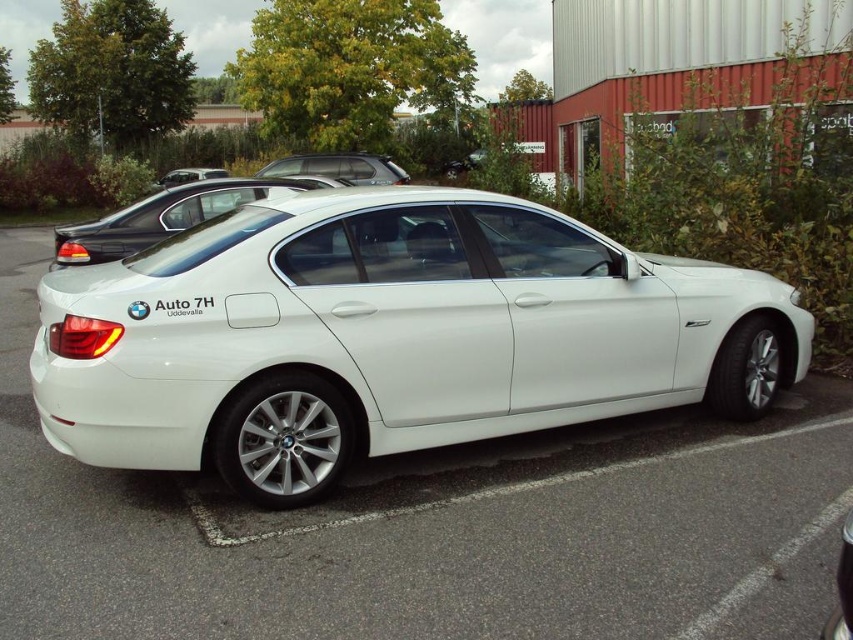
Question: Among these points, which one is farthest from the camera?

Choices:
 (A) (146, 204)
 (B) (71, 269)

Answer: (A)

Question: Estimate the real-world distances between objects in this image. Which object is farther from the matte black car at upper center?

Choices:
 (A) satin silver suv at upper center
 (B) white metallic car at center

Answer: (B)

Question: Is white metallic car at center smaller than satin silver suv at upper center?

Choices:
 (A) yes
 (B) no

Answer: (B)

Question: Which of these objects is positioned farthest from the satin silver suv at upper center?

Choices:
 (A) matte black car at upper center
 (B) white metallic car at center

Answer: (A)

Question: Where is white metallic car at center located in relation to matte black car at upper center in the image?

Choices:
 (A) below
 (B) above

Answer: (A)

Question: Is satin silver suv at upper center wider than matte black car at upper center?

Choices:
 (A) no
 (B) yes

Answer: (A)